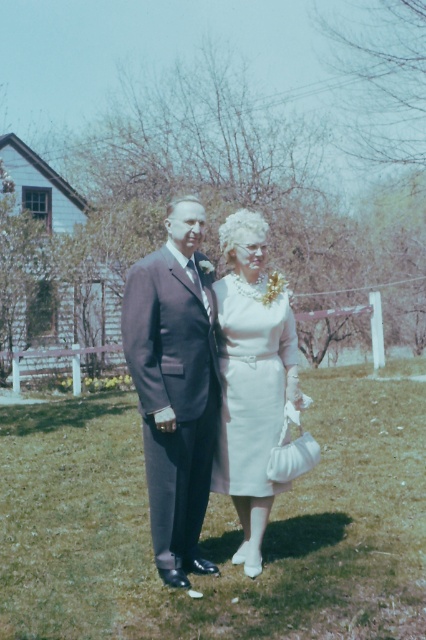
Does matte black suit at center appear on the left side of white satin dress at center?

Correct, you'll find matte black suit at center to the left of white satin dress at center.

How distant is matte black suit at center from white satin dress at center?

matte black suit at center and white satin dress at center are 9.03 inches apart.

What are the coordinates of `matte black suit at center` in the screenshot? It's located at (175, 385).

At what (x,y) coordinates should I click in order to perform the action: click on matte black suit at center. Please return your answer as a coordinate pair (x, y). The height and width of the screenshot is (640, 426). Looking at the image, I should click on (175, 385).